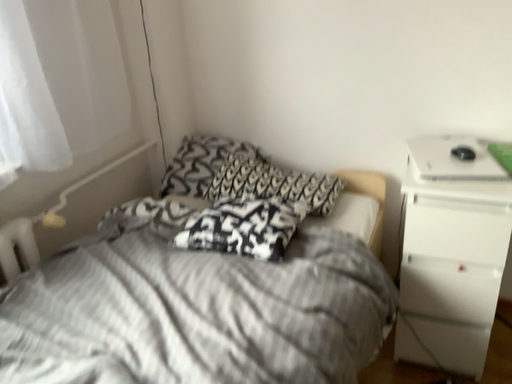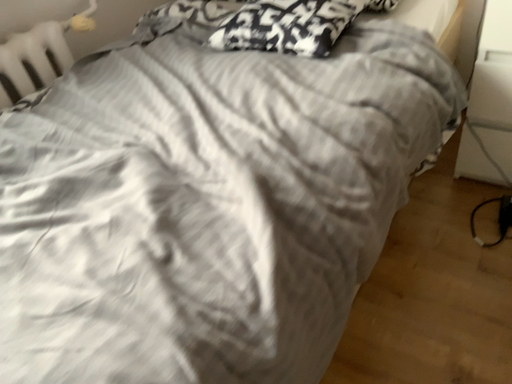
Question: Which way did the camera rotate in the video?

Choices:
 (A) rotated left
 (B) rotated right

Answer: (A)